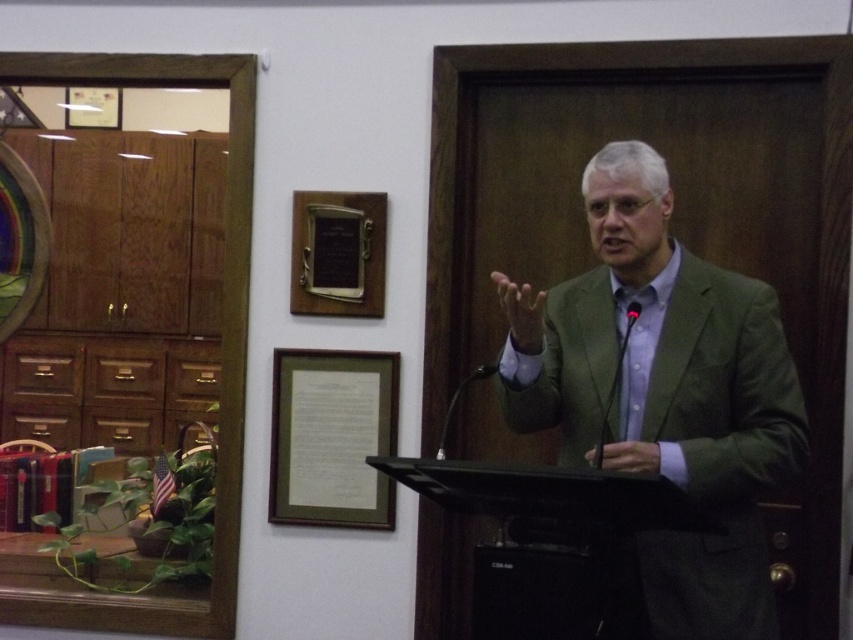
You are an event organizer who needs to adjust the stage setup. You see the green fabric suit at center and the green matte picture frame at center. Which object is covering the other one?

The green fabric suit at center is positioned over green matte picture frame at center, so the suit is covering the frame.

You are an event organizer who needs to adjust the lighting for the speaker. The green fabric suit at center and the wooden plaque at upper center are both important focal points. Which object should you focus on first to ensure it is well lit since it is closer to the viewer?

The green fabric suit at center is closer to the viewer than the wooden plaque at upper center, so you should focus on lighting the green fabric suit at center first.